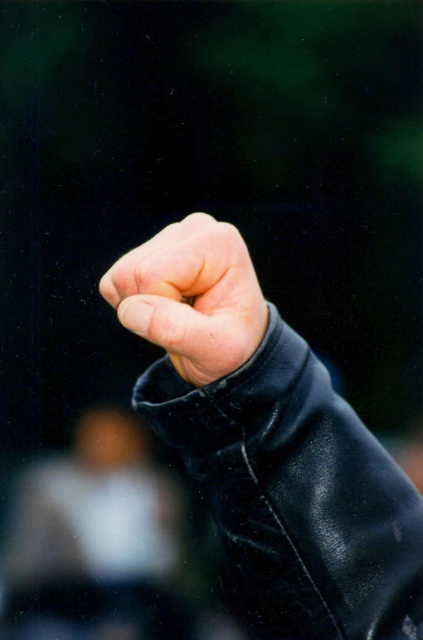
You are designing a poster and need to place a black leather jacket at center and a leather fist at center on it. Since the poster has limited space, which object should you scale down to fit both without overlapping?

The black leather jacket at center is wider than the leather fist at center, so you should scale down the black leather jacket at center to make space for the leather fist at center while maintaining their proportions.

You are an artist analyzing the composition of the image. You notice the black leather jacket at center and the leather fist at center. Based on their positions, which object is placed higher in the image?

The leather fist at center is placed higher than the black leather jacket at center in the image.

You are a photographer adjusting your camera to focus on two points in the image. The first point is point (x=266, y=436) and the second is point (x=173, y=240). Which point should you focus on first if you want to capture the one that is closer to the camera?

Point (x=266, y=436) is in front of point (x=173, y=240), so you should focus on point (x=266, y=436) first as it is closer to the camera.